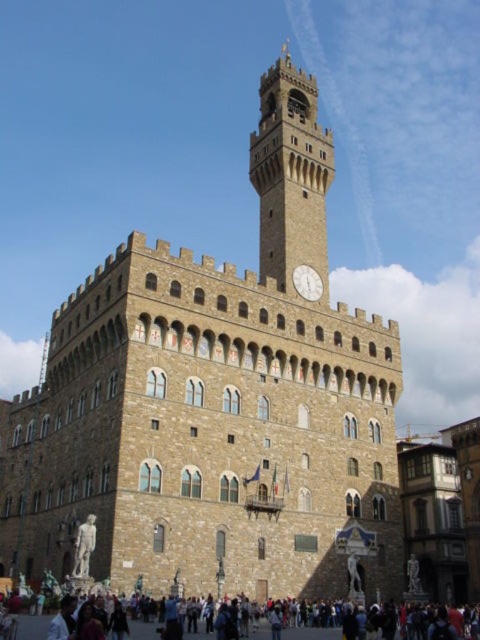
Question: Which point is farther from the camera taking this photo?

Choices:
 (A) (284, 188)
 (B) (307, 282)

Answer: (A)

Question: Estimate the real-world distances between objects in this image. Which object is closer to the white stone clock at center?

Choices:
 (A) stone statue at lower left
 (B) dark clothing at lower center
 (C) brown stone clock tower at upper center

Answer: (C)

Question: Which point is closer to the camera taking this photo?

Choices:
 (A) (x=299, y=172)
 (B) (x=76, y=577)
 (C) (x=135, y=634)
 (D) (x=304, y=269)

Answer: (C)

Question: Does brown stone clock tower at upper center lie behind white stone clock at center?

Choices:
 (A) no
 (B) yes

Answer: (A)

Question: Is dark clothing at lower center positioned at the back of white stone clock at center?

Choices:
 (A) no
 (B) yes

Answer: (A)

Question: Is dark clothing at lower center above stone statue at lower left?

Choices:
 (A) no
 (B) yes

Answer: (A)